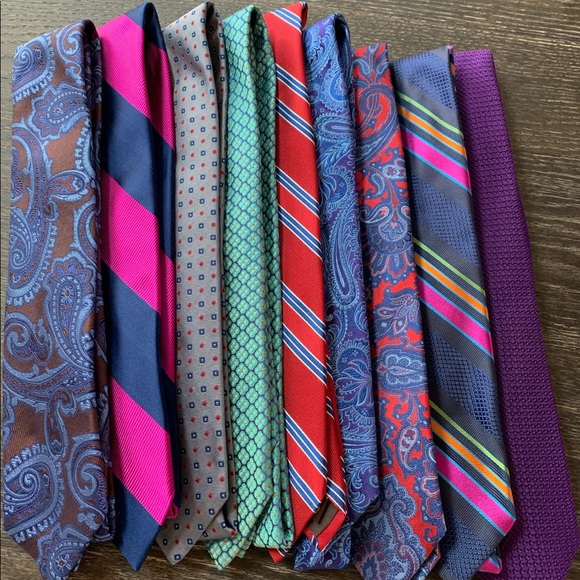
Locate an element on the screen. This screenshot has width=580, height=580. background table is located at coordinates (542, 50).